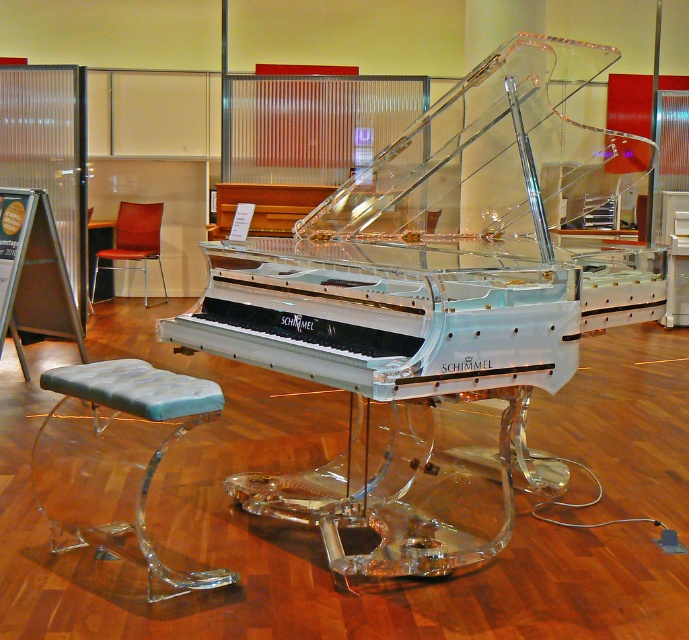
You are a piano teacher who wants to adjust the height of the clear acrylic stool at center and the leather seat at center so that both are at the same level. According to the scene description, which object needs to be raised and which one lowered?

The clear acrylic stool at center has a lesser height compared to the leather seat at center. Therefore, the clear acrylic stool at center needs to be raised, and the leather seat at center should be lowered to achieve the same level.

You are a customer in a furniture store and want to sit on the leather seat at center. There is a clear acrylic stool at center blocking your path. Can you move the stool to access the seat?

The clear acrylic stool at center is in front of the leather seat at center, so you can move the stool to access the seat.